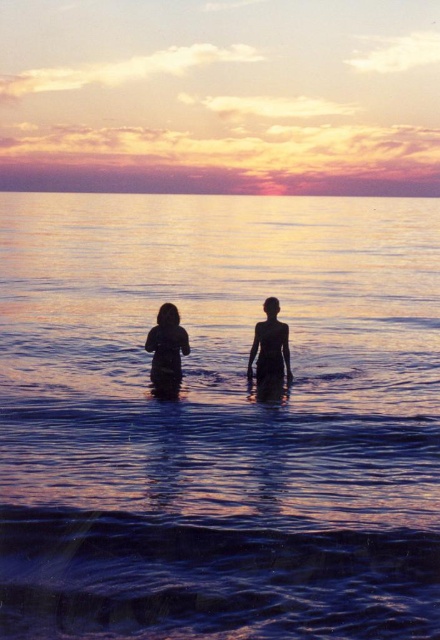
You are planning to take a photo of the sunset scene. You want to ensure both the silhouette figures at center and the silhouette skin at center are fully visible in the frame. Which object should you focus on to ensure they are both in the shot?

You should focus on the silhouette skin at center because it is wider than the silhouette figures at center, ensuring both will fit within the frame.

You are a photographer trying to capture the sunset scene. You notice two points in the image at coordinates point (160, 340) and point (271, 348). Which point is closer to your camera lens?

Point (160, 340) is closer to the camera than point (271, 348).

You are a photographer trying to capture the sunset scene. You notice two silhouette figures at center and a silhouette skin at center in the image. Which object is closer to the camera?

The silhouette figures at center is positioned over silhouette skin at center, meaning it is closer to the camera.